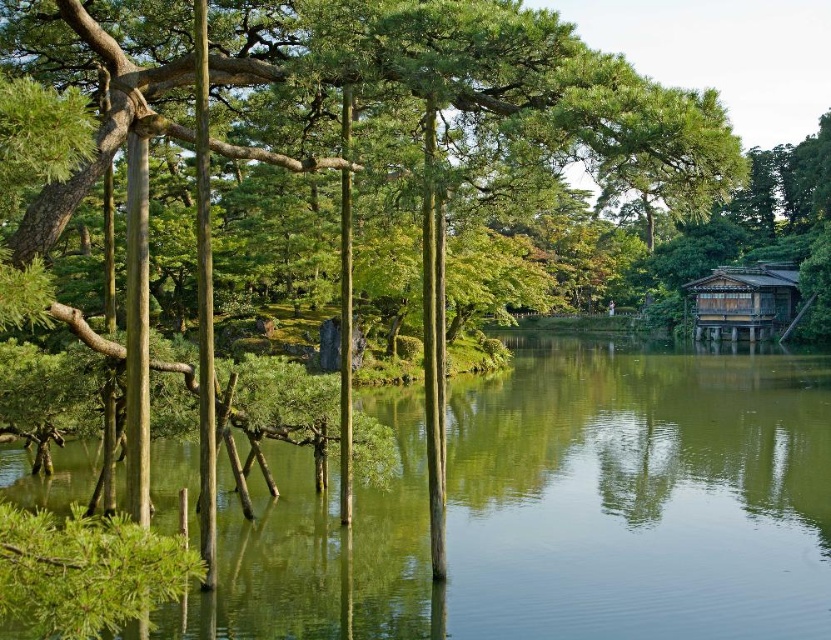
Question: Is green reflective water at center closer to camera compared to wooden/wooden-textured hut at right?

Choices:
 (A) no
 (B) yes

Answer: (B)

Question: Which point is farther from the camera taking this photo?

Choices:
 (A) click(x=686, y=285)
 (B) click(x=519, y=518)

Answer: (A)

Question: Among these objects, which one is nearest to the camera?

Choices:
 (A) green reflective water at center
 (B) wooden/wooden-textured hut at right

Answer: (A)

Question: Is green reflective water at center positioned in front of wooden/wooden-textured hut at right?

Choices:
 (A) no
 (B) yes

Answer: (B)

Question: Does green reflective water at center appear on the left side of wooden/wooden-textured hut at right?

Choices:
 (A) yes
 (B) no

Answer: (A)